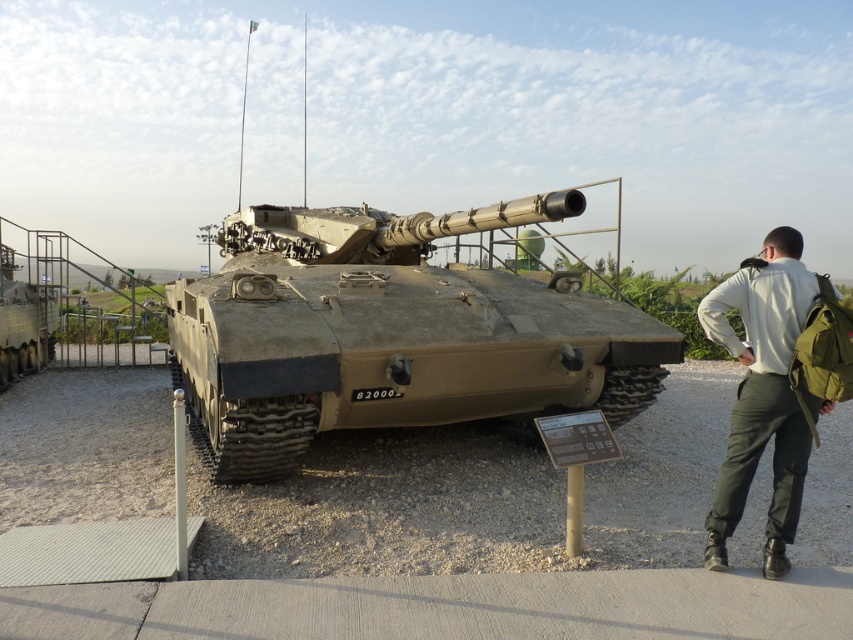
Where is the camouflage textured tank at center located in the image?

The camouflage textured tank at center is located at point (392, 333) in the image.

Consider the image. You are a visitor at the exhibition and want to take a photo of the camouflage textured tank at center and khaki fabric pants at right. Which object should you focus on first if you want to include both in your frame without moving the camera?

You should focus on the camouflage textured tank at center first because it is positioned on the left side of the khaki fabric pants at right, so capturing it first ensures both objects remain in the frame without needing to adjust the camera position.

You are a visitor at the exhibition and want to take a photo of the khaki fabric pants at right and camouflage textured tank at center. Which object should you focus on first to ensure both are in the frame?

You should focus on the camouflage textured tank at center first because the khaki fabric pants at right is behind it, so centering the tank will keep both in the frame.